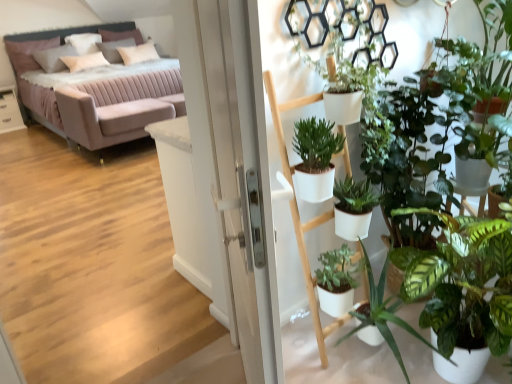
Question: From a real-world perspective, is white soft pillow at upper left, the third pillow viewed from the left, located beneath white glossy table at left?

Choices:
 (A) yes
 (B) no

Answer: (B)

Question: From the image's perspective, is white soft pillow at upper left, the third pillow viewed from the left, below white glossy table at left?

Choices:
 (A) yes
 (B) no

Answer: (B)

Question: Does white soft pillow at upper left, the third pillow viewed from the left, appear on the left side of white glossy table at left?

Choices:
 (A) yes
 (B) no

Answer: (B)

Question: Considering the relative sizes of white soft pillow at upper left, the third pillow viewed from the left, and white glossy table at left in the image provided, is white soft pillow at upper left, the third pillow viewed from the left, smaller than white glossy table at left?

Choices:
 (A) yes
 (B) no

Answer: (A)

Question: Can you confirm if white soft pillow at upper left, the third pillow viewed from the left, is taller than white glossy table at left?

Choices:
 (A) no
 (B) yes

Answer: (A)

Question: Does white soft pillow at upper left, acting as the 2th pillow starting from the right, have a lesser width compared to white glossy table at left?

Choices:
 (A) no
 (B) yes

Answer: (B)

Question: Is white soft pillow at upper left, acting as the 2th pillow starting from the right, not within white glossy screen door at center?

Choices:
 (A) no
 (B) yes

Answer: (B)

Question: Is white soft pillow at upper left, the third pillow viewed from the left, positioned far away from white glossy screen door at center?

Choices:
 (A) no
 (B) yes

Answer: (B)

Question: Is white soft pillow at upper left, the third pillow viewed from the left, behind white glossy screen door at center?

Choices:
 (A) no
 (B) yes

Answer: (B)

Question: From the image's perspective, is white soft pillow at upper left, the third pillow viewed from the left, below white glossy screen door at center?

Choices:
 (A) no
 (B) yes

Answer: (A)

Question: Would you say white soft pillow at upper left, the third pillow viewed from the left, contains white glossy screen door at center?

Choices:
 (A) no
 (B) yes

Answer: (A)

Question: Does white soft pillow at upper left, the third pillow viewed from the left, have a greater height compared to white glossy screen door at center?

Choices:
 (A) yes
 (B) no

Answer: (B)

Question: Does velvet pink couch at upper left lie behind white soft pillow at upper left, acting as the 2th pillow starting from the right?

Choices:
 (A) yes
 (B) no

Answer: (B)